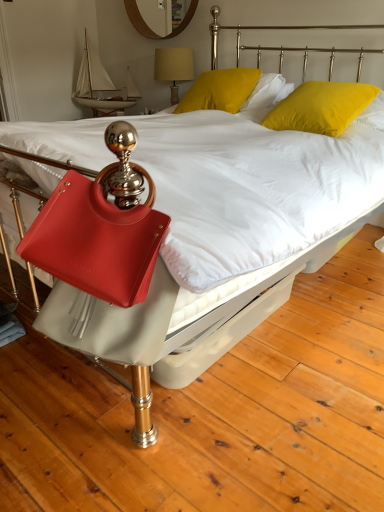
What do you see at coordinates (173, 67) in the screenshot? This screenshot has height=512, width=384. I see `matte yellow lampshade at upper center` at bounding box center [173, 67].

Where is `satin red handbag at lower left`? The image size is (384, 512). satin red handbag at lower left is located at coordinates (100, 227).

Locate an element on the screen. matte yellow lampshade at upper center is located at coordinates (173, 67).

Considering the relative sizes of yellow velvet pillow at upper right, placed as the 2th pillow when sorted from left to right, and wooden mirror at upper center in the image provided, is yellow velvet pillow at upper right, placed as the 2th pillow when sorted from left to right, thinner than wooden mirror at upper center?

Incorrect, the width of yellow velvet pillow at upper right, placed as the 2th pillow when sorted from left to right, is not less than that of wooden mirror at upper center.

How many degrees apart are the facing directions of yellow velvet pillow at upper right, the first pillow in the right-to-left sequence, and wooden mirror at upper center?

There is a 0.198-degree angle between the facing directions of yellow velvet pillow at upper right, the first pillow in the right-to-left sequence, and wooden mirror at upper center.

Does yellow velvet pillow at upper right, the first pillow in the right-to-left sequence, have a smaller size compared to wooden mirror at upper center?

Actually, yellow velvet pillow at upper right, the first pillow in the right-to-left sequence, might be larger than wooden mirror at upper center.

Between point (146, 26) and point (235, 71), which one is positioned in front?

The point (235, 71) is closer.

Measure the distance between wooden mirror at upper center and yellow matte pillow at upper center, marked as the 2th pillow in a right-to-left arrangement.

A distance of 1.04 meters exists between wooden mirror at upper center and yellow matte pillow at upper center, marked as the 2th pillow in a right-to-left arrangement.

Who is more distant, wooden mirror at upper center or yellow matte pillow at upper center, marked as the 2th pillow in a right-to-left arrangement?

wooden mirror at upper center is further away from the camera.

Can you tell me how much wooden mirror at upper center and yellow matte pillow at upper center, marked as the 2th pillow in a right-to-left arrangement, differ in facing direction?

The angle between the facing direction of wooden mirror at upper center and the facing direction of yellow matte pillow at upper center, marked as the 2th pillow in a right-to-left arrangement, is 8.64 degrees.

Which object is closer to the camera, wooden mirror at upper center or yellow velvet pillow at upper right, placed as the 2th pillow when sorted from left to right?

Positioned in front is yellow velvet pillow at upper right, placed as the 2th pillow when sorted from left to right.

Based on the photo, how many degrees apart are the facing directions of wooden mirror at upper center and yellow velvet pillow at upper right, the first pillow in the right-to-left sequence?

wooden mirror at upper center and yellow velvet pillow at upper right, the first pillow in the right-to-left sequence, are facing 0.198 degrees away from each other.

Considering the relative sizes of wooden mirror at upper center and yellow velvet pillow at upper right, the first pillow in the right-to-left sequence, in the image provided, is wooden mirror at upper center smaller than yellow velvet pillow at upper right, the first pillow in the right-to-left sequence,?

Indeed, wooden mirror at upper center has a smaller size compared to yellow velvet pillow at upper right, the first pillow in the right-to-left sequence.

From the image's perspective, which object appears higher, wooden mirror at upper center or yellow velvet pillow at upper right, placed as the 2th pillow when sorted from left to right?

wooden mirror at upper center, from the image's perspective.

Which is behind, satin red handbag at lower left or wooden mirror at upper center?

wooden mirror at upper center is further from the camera.

Is wooden mirror at upper center surrounded by satin red handbag at lower left?

No, satin red handbag at lower left does not contain wooden mirror at upper center.

Between point (103, 239) and point (196, 6), which one is positioned in front?

The point (103, 239) is more forward.

Is satin red handbag at lower left not close to wooden mirror at upper center?

Absolutely, satin red handbag at lower left is distant from wooden mirror at upper center.

Can you confirm if matte yellow lampshade at upper center is smaller than satin red handbag at lower left?

No.

Which of these two, matte yellow lampshade at upper center or satin red handbag at lower left, stands shorter?

Standing shorter between the two is satin red handbag at lower left.

From the picture: Is matte yellow lampshade at upper center placed right next to satin red handbag at lower left?

matte yellow lampshade at upper center and satin red handbag at lower left are clearly separated.

From the image's perspective, which is below, matte yellow lampshade at upper center or satin red handbag at lower left?

satin red handbag at lower left appears lower in the image.

Can you confirm if yellow velvet pillow at upper right, placed as the 2th pillow when sorted from left to right, is bigger than yellow matte pillow at upper center, marked as the 2th pillow in a right-to-left arrangement?

No.

Is yellow velvet pillow at upper right, the first pillow in the right-to-left sequence, aimed at yellow matte pillow at upper center, arranged as the first pillow when viewed from the left?

No, yellow velvet pillow at upper right, the first pillow in the right-to-left sequence, is not facing towards yellow matte pillow at upper center, arranged as the first pillow when viewed from the left.

Is yellow velvet pillow at upper right, placed as the 2th pillow when sorted from left to right, behind yellow matte pillow at upper center, marked as the 2th pillow in a right-to-left arrangement?

No.

From a real-world perspective, which is physically below, satin red handbag at lower left or yellow matte pillow at upper center, arranged as the first pillow when viewed from the left?

From a 3D spatial view, satin red handbag at lower left is below.

Considering their positions, is satin red handbag at lower left located in front of or behind yellow matte pillow at upper center, marked as the 2th pillow in a right-to-left arrangement?

Visually, satin red handbag at lower left is located in front of yellow matte pillow at upper center, marked as the 2th pillow in a right-to-left arrangement.

What's the angular difference between satin red handbag at lower left and yellow matte pillow at upper center, arranged as the first pillow when viewed from the left,'s facing directions?

2.74 degrees separate the facing orientations of satin red handbag at lower left and yellow matte pillow at upper center, arranged as the first pillow when viewed from the left.

Is the surface of satin red handbag at lower left in direct contact with yellow matte pillow at upper center, marked as the 2th pillow in a right-to-left arrangement?

satin red handbag at lower left is not next to yellow matte pillow at upper center, marked as the 2th pillow in a right-to-left arrangement, and they're not touching.

Identify the location of mirror on the left of yellow velvet pillow at upper right, the first pillow in the right-to-left sequence. (139, 20).

You are a GUI agent. You are given a task and a screenshot of the screen. Output one action in this format:
    pyautogui.click(x=<x>, y=<y>)
    Task: Click on the 1st pillow in front of the wooden mirror at upper center, starting your count from the anchor
    The width and height of the screenshot is (384, 512).
    Given the screenshot: What is the action you would take?
    pyautogui.click(x=220, y=90)

Looking at the image, which one is located closer to matte yellow lampshade at upper center, wooden mirror at upper center or satin red handbag at lower left?

wooden mirror at upper center is positioned closer to the anchor matte yellow lampshade at upper center.

Which object lies nearer to the anchor point yellow matte pillow at upper center, marked as the 2th pillow in a right-to-left arrangement, wooden mirror at upper center or matte yellow lampshade at upper center?

matte yellow lampshade at upper center lies closer to yellow matte pillow at upper center, marked as the 2th pillow in a right-to-left arrangement, than the other object.

Considering their positions, is satin red handbag at lower left positioned further to wooden mirror at upper center than yellow velvet pillow at upper right, the first pillow in the right-to-left sequence?

satin red handbag at lower left.

Which object lies nearer to the anchor point yellow velvet pillow at upper right, the first pillow in the right-to-left sequence, matte yellow lampshade at upper center or wooden mirror at upper center?

matte yellow lampshade at upper center is closer to yellow velvet pillow at upper right, the first pillow in the right-to-left sequence.

Looking at the image, which one is located further to matte yellow lampshade at upper center, yellow matte pillow at upper center, marked as the 2th pillow in a right-to-left arrangement, or yellow velvet pillow at upper right, the first pillow in the right-to-left sequence?

yellow velvet pillow at upper right, the first pillow in the right-to-left sequence, is further to matte yellow lampshade at upper center.

Looking at the image, which one is located further to yellow velvet pillow at upper right, the first pillow in the right-to-left sequence, yellow matte pillow at upper center, marked as the 2th pillow in a right-to-left arrangement, or wooden mirror at upper center?

wooden mirror at upper center is positioned further to the anchor yellow velvet pillow at upper right, the first pillow in the right-to-left sequence.

Looking at the image, which one is located further to matte yellow lampshade at upper center, yellow velvet pillow at upper right, placed as the 2th pillow when sorted from left to right, or wooden mirror at upper center?

yellow velvet pillow at upper right, placed as the 2th pillow when sorted from left to right, is positioned further to the anchor matte yellow lampshade at upper center.

Considering their positions, is wooden mirror at upper center positioned closer to matte yellow lampshade at upper center than yellow matte pillow at upper center, arranged as the first pillow when viewed from the left?

wooden mirror at upper center is positioned closer to the anchor matte yellow lampshade at upper center.

Identify the location of mirror between satin red handbag at lower left and matte yellow lampshade at upper center from front to back. (139, 20).

This screenshot has height=512, width=384. I want to click on pillow located between satin red handbag at lower left and yellow matte pillow at upper center, arranged as the first pillow when viewed from the left, in the depth direction, so click(x=321, y=106).

Identify the location of pillow between matte yellow lampshade at upper center and yellow velvet pillow at upper right, the first pillow in the right-to-left sequence. (220, 90).

This screenshot has width=384, height=512. I want to click on pillow between wooden mirror at upper center and yellow velvet pillow at upper right, the first pillow in the right-to-left sequence, so click(x=220, y=90).